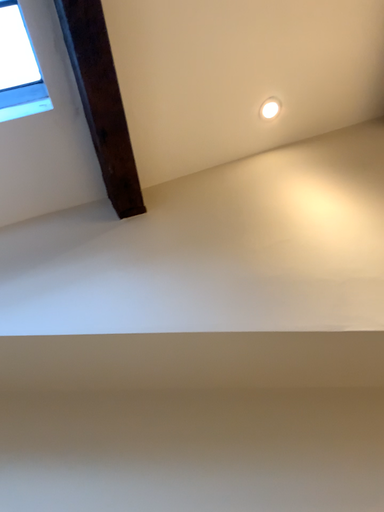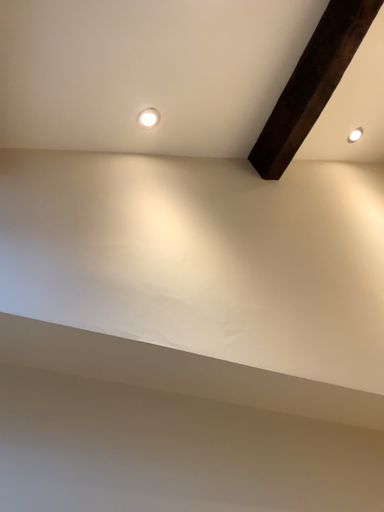
Question: How did the camera likely rotate when shooting the video?

Choices:
 (A) rotated right
 (B) rotated left

Answer: (A)